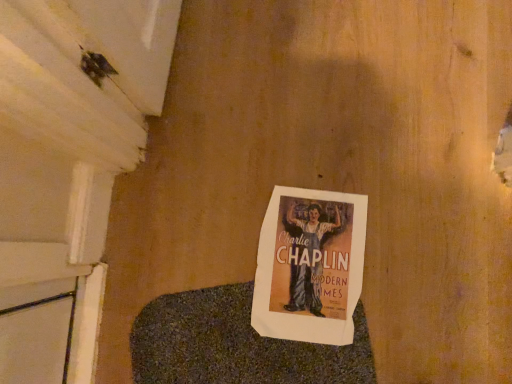
Question: Is matte paper poster at center behind blue textured blanket at center?

Choices:
 (A) no
 (B) yes

Answer: (B)

Question: From a real-world perspective, is matte paper poster at center positioned under blue textured blanket at center based on gravity?

Choices:
 (A) yes
 (B) no

Answer: (A)

Question: Can you confirm if matte paper poster at center is taller than blue textured blanket at center?

Choices:
 (A) no
 (B) yes

Answer: (A)

Question: From a real-world perspective, is matte paper poster at center over blue textured blanket at center?

Choices:
 (A) no
 (B) yes

Answer: (A)

Question: Could blue textured blanket at center be considered to be inside matte paper poster at center?

Choices:
 (A) no
 (B) yes

Answer: (A)

Question: Is matte paper poster at center facing away from blue textured blanket at center?

Choices:
 (A) yes
 (B) no

Answer: (B)

Question: Is blue textured blanket at center further to the viewer compared to matte paper poster at center?

Choices:
 (A) no
 (B) yes

Answer: (A)

Question: Is blue textured blanket at center next to matte paper poster at center and touching it?

Choices:
 (A) yes
 (B) no

Answer: (B)

Question: Can you confirm if blue textured blanket at center is positioned to the left of matte paper poster at center?

Choices:
 (A) yes
 (B) no

Answer: (A)

Question: From the image's perspective, is blue textured blanket at center on top of matte paper poster at center?

Choices:
 (A) no
 (B) yes

Answer: (A)

Question: Is blue textured blanket at center to the right of matte paper poster at center from the viewer's perspective?

Choices:
 (A) yes
 (B) no

Answer: (B)

Question: Is blue textured blanket at center oriented away from matte paper poster at center?

Choices:
 (A) no
 (B) yes

Answer: (A)

Question: From the image's perspective, is matte paper poster at center positioned above or below blue textured blanket at center?

Choices:
 (A) above
 (B) below

Answer: (A)